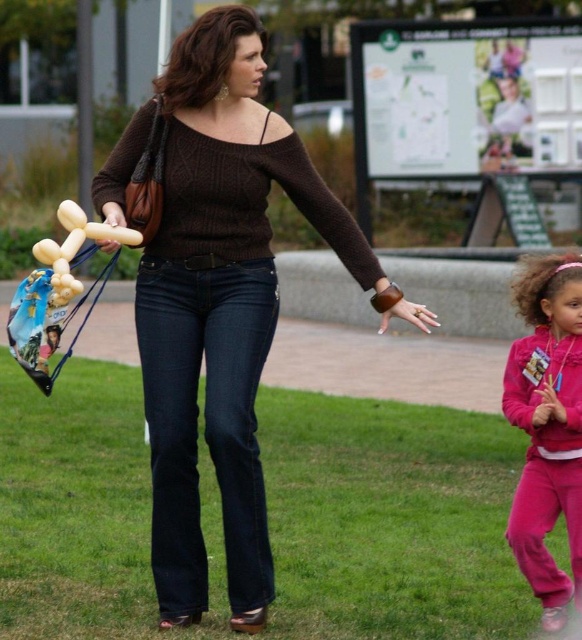
Between golden balloon animal at left and translucent yellow balloon animal at left, which one appears on the right side from the viewer's perspective?

Positioned to the right is translucent yellow balloon animal at left.

This screenshot has width=582, height=640. Identify the location of golden balloon animal at left. (58, 292).

Who is positioned more to the right, green grass at lower center or translucent yellow balloon animal at left?

green grass at lower center is more to the right.

Can you confirm if green grass at lower center is positioned to the right of translucent yellow balloon animal at left?

Indeed, green grass at lower center is positioned on the right side of translucent yellow balloon animal at left.

Does point (466, 476) lie behind point (47, 262)?

Yes, it is.

Find the location of a particular element. green grass at lower center is located at coordinates (391, 518).

Does point (391, 314) come closer to viewer compared to point (104, 234)?

That is False.

Which is above, brown knit sweater at center or golden balloon animal at left?

golden balloon animal at left is higher up.

Is point (223, 236) closer to viewer compared to point (26, 278)?

No, (223, 236) is behind (26, 278).

Locate an element on the screen. This screenshot has height=640, width=582. brown knit sweater at center is located at coordinates (x=223, y=307).